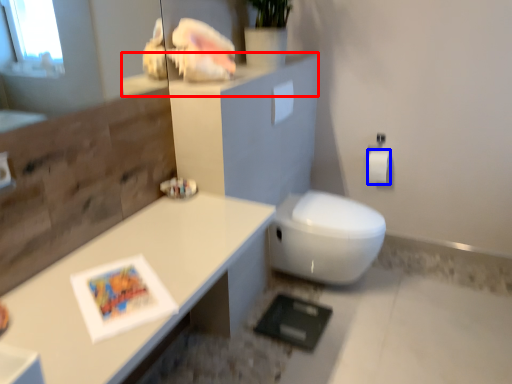
Question: Which point is further to the camera, ledge (highlighted by a red box) or toilet paper (highlighted by a blue box)?

Choices:
 (A) ledge
 (B) toilet paper

Answer: (B)